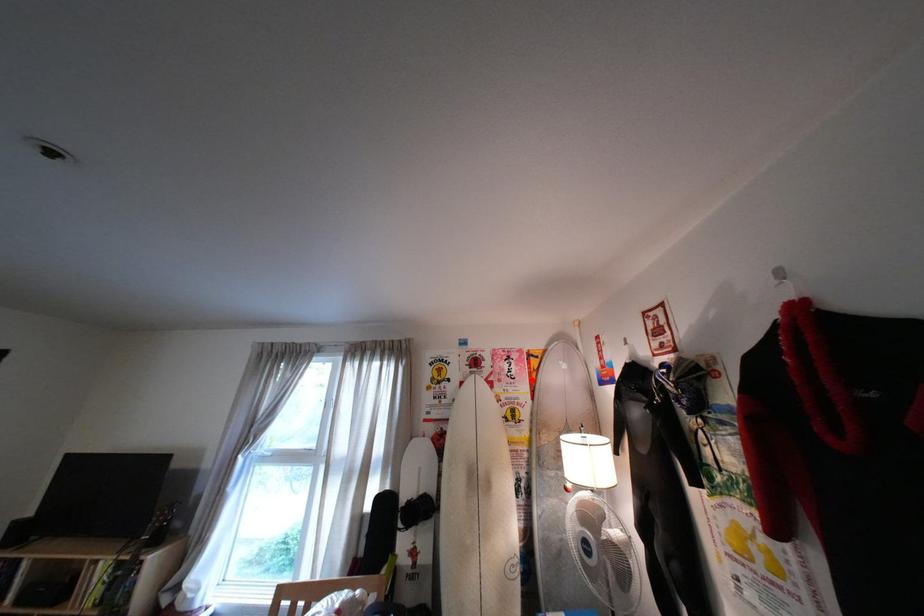
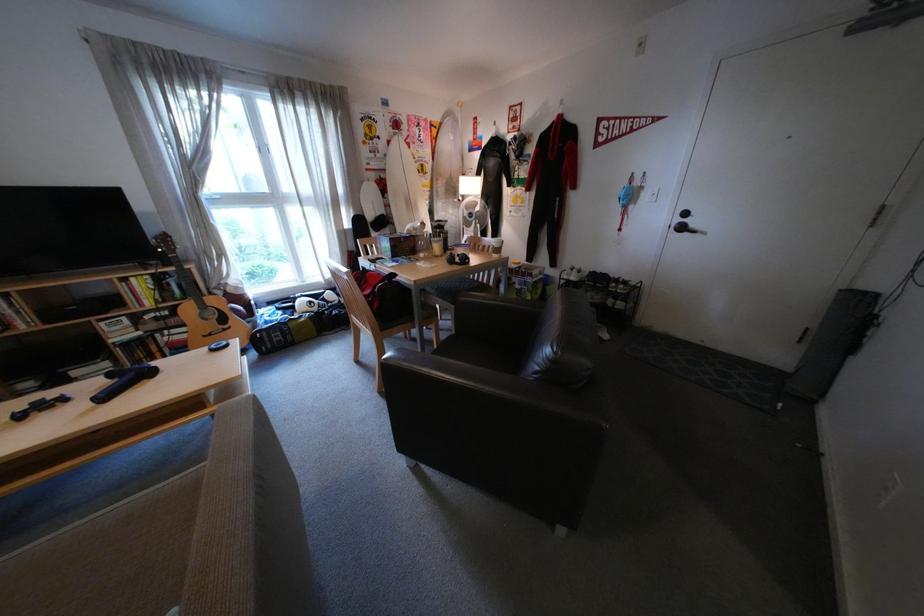
Question: I am providing you with two images of the same scene from different viewpoints. In image1, a red point is highlighted. Considering the same 3D point in image2, which of the following is correct?

Choices:
 (A) It is closer
 (B) It is farther

Answer: (A)